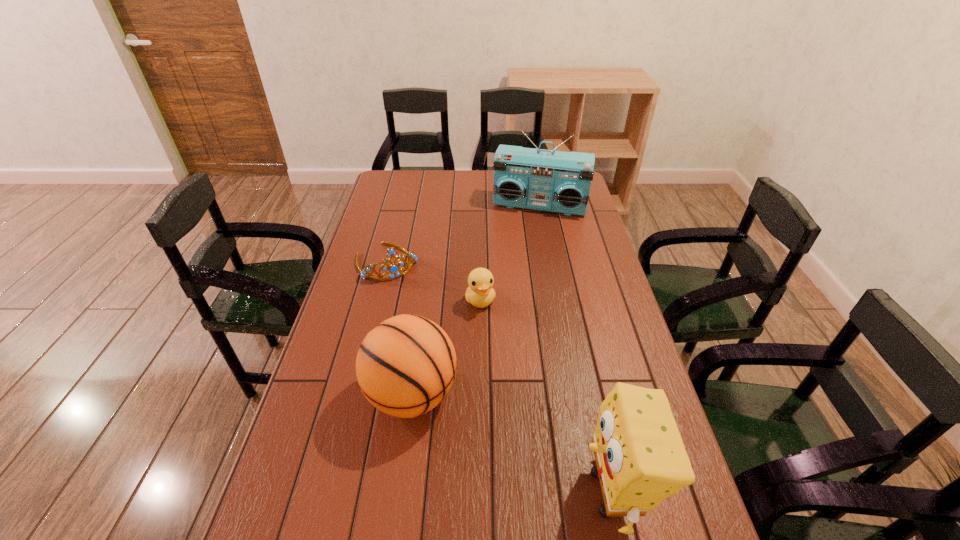
Where is `basketball`? basketball is located at coordinates (405, 366).

You are a GUI agent. You are given a task and a screenshot of the screen. Output one action in this format:
    pyautogui.click(x=<x>, y=<y>)
    Task: Click on the tiara
    The width and height of the screenshot is (960, 540).
    Given the screenshot: What is the action you would take?
    pyautogui.click(x=394, y=268)

The height and width of the screenshot is (540, 960). What are the coordinates of `radio receiver` in the screenshot? It's located at (560, 182).

You are a GUI agent. You are given a task and a screenshot of the screen. Output one action in this format:
    pyautogui.click(x=<x>, y=<y>)
    Task: Click on the duck
    The width and height of the screenshot is (960, 540).
    Given the screenshot: What is the action you would take?
    pyautogui.click(x=480, y=293)

At what (x,y) coordinates should I click in order to perform the action: click on the third farthest object. Please return your answer as a coordinate pair (x, y). The width and height of the screenshot is (960, 540). Looking at the image, I should click on (480, 293).

At what (x,y) coordinates should I click in order to perform the action: click on free space located on the back of the basketball. Please return your answer as a coordinate pair (x, y). The width and height of the screenshot is (960, 540). Looking at the image, I should click on (419, 344).

You are a GUI agent. You are given a task and a screenshot of the screen. Output one action in this format:
    pyautogui.click(x=<x>, y=<y>)
    Task: Click on the free space located on the front-facing side of the tiara
    The image size is (960, 540).
    Given the screenshot: What is the action you would take?
    pyautogui.click(x=420, y=316)

Find the location of `free spot located on the front-facing side of the tiara`. free spot located on the front-facing side of the tiara is located at coordinates (428, 331).

You are a GUI agent. You are given a task and a screenshot of the screen. Output one action in this format:
    pyautogui.click(x=<x>, y=<y>)
    Task: Click on the free point located 0.380m on the front-facing side of the tiara
    The image size is (960, 540).
    Given the screenshot: What is the action you would take?
    pyautogui.click(x=444, y=356)

In order to click on free space located 0.350m on the front-facing side of the farthest object in this screenshot , I will do `click(516, 275)`.